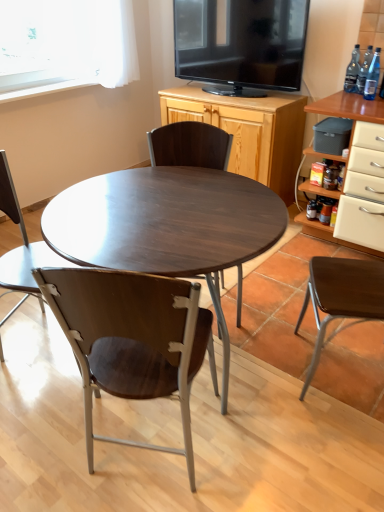
What are the coordinates of `free space in front of brown wood chair at right, acting as the fourth chair starting from the left` in the screenshot? It's located at (338, 440).